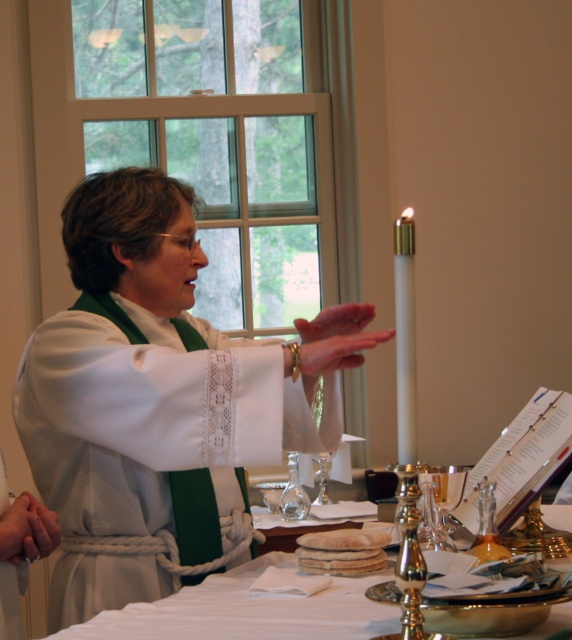
Question: Is white lace fabric at center positioned in front of white cloth at center?

Choices:
 (A) yes
 (B) no

Answer: (A)

Question: Does white lace fabric at center lie in front of clear glass wine glass at center?

Choices:
 (A) yes
 (B) no

Answer: (A)

Question: Can you confirm if transparent glass wine glass at center is wider than clear glass wine glass at center?

Choices:
 (A) yes
 (B) no

Answer: (A)

Question: Which of the following is the closest to the observer?

Choices:
 (A) (188, 237)
 (B) (291, 516)

Answer: (A)

Question: Which point appears closest to the camera in this image?

Choices:
 (A) (297, 497)
 (B) (97, 572)

Answer: (B)

Question: Which point appears farthest from the camera in this image?

Choices:
 (A) (148, 488)
 (B) (299, 518)
 (C) (408, 337)

Answer: (B)